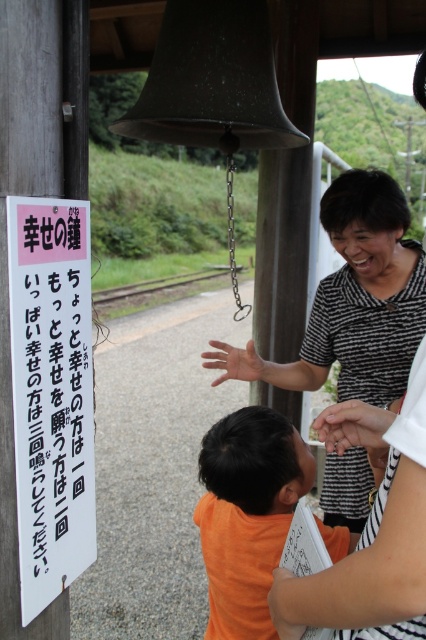
Question: Which point is closer to the camera taking this photo?

Choices:
 (A) (331, 426)
 (B) (78, 352)
 (C) (382, 470)

Answer: (A)

Question: Where is pink paper sign at left located in relation to orange fabric shirt at center in the image?

Choices:
 (A) below
 (B) above

Answer: (B)

Question: Is pink paper sign at left to the left of smooth skin hand at center from the viewer's perspective?

Choices:
 (A) no
 (B) yes

Answer: (B)

Question: Among these objects, which one is farthest from the camera?

Choices:
 (A) orange fabric hand at lower center
 (B) striped fabric blouse at center
 (C) orange fabric shirt at center

Answer: (B)

Question: In this image, where is smooth skin hand at center located relative to gray metallic train track at center?

Choices:
 (A) left
 (B) right

Answer: (B)

Question: Which object is positioned farthest from the striped fabric blouse at center?

Choices:
 (A) smooth skin hand at center
 (B) orange fabric hand at lower center

Answer: (B)